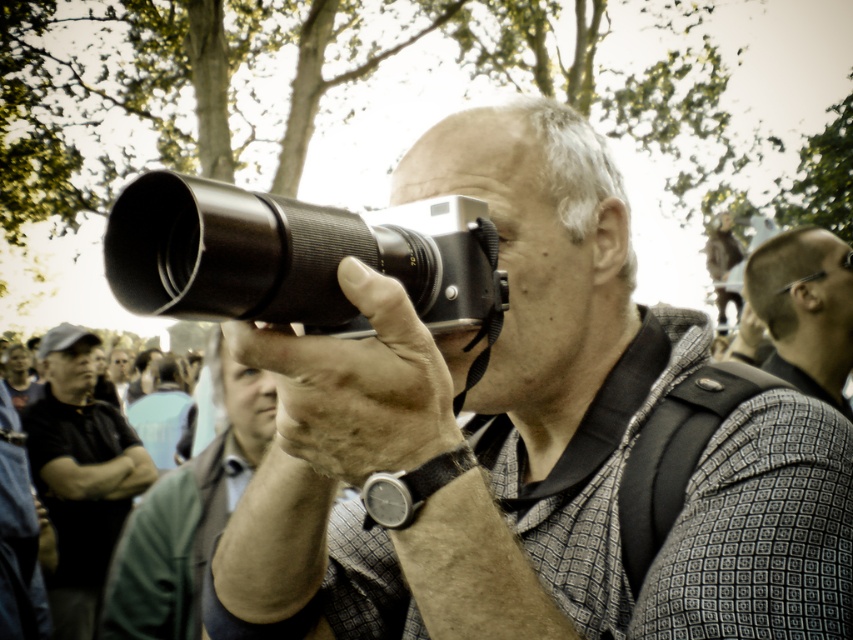
Question: Which of the following is the farthest from the observer?

Choices:
 (A) silver metallic camera at center
 (B) matte black camera at center

Answer: (B)

Question: Is matte black camera at center positioned behind green leather jacket at center?

Choices:
 (A) yes
 (B) no

Answer: (B)

Question: Which object is closer to the camera taking this photo?

Choices:
 (A) matte black camera at center
 (B) shiny black hair at upper right
 (C) dark gray cap at lower left
 (D) green leather jacket at center

Answer: (A)

Question: Is dark gray cap at lower left to the right of shiny black hair at upper right from the viewer's perspective?

Choices:
 (A) no
 (B) yes

Answer: (A)

Question: Can you confirm if matte black camera at center is positioned below green leather jacket at center?

Choices:
 (A) yes
 (B) no

Answer: (B)

Question: Which object appears closest to the camera in this image?

Choices:
 (A) green leather jacket at center
 (B) dark gray cap at lower left

Answer: (A)